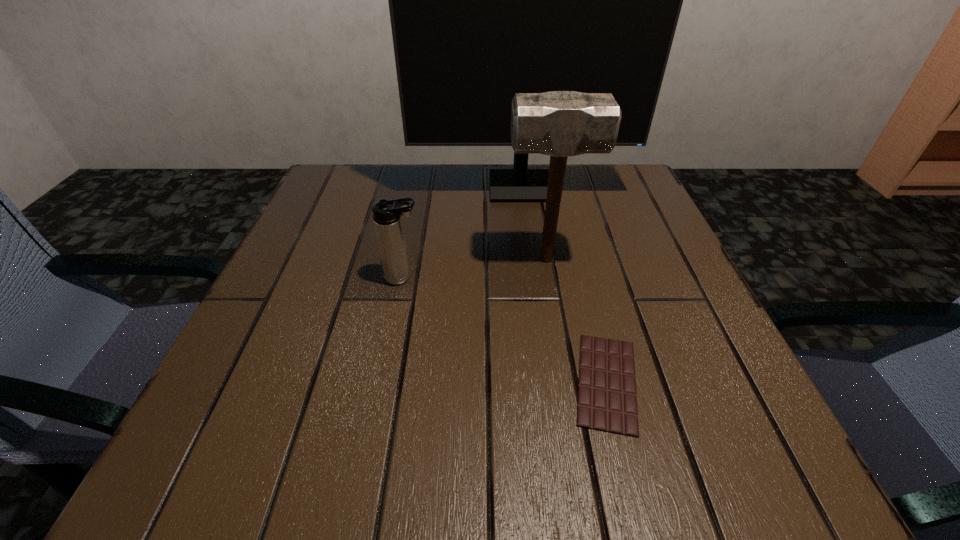
I want to click on vacant position at the left edge of the desktop, so click(297, 251).

In the image, there is a desktop. At what (x,y) coordinates should I click in order to perform the action: click on vacant space at the right edge. Please return your answer as a coordinate pair (x, y). This screenshot has width=960, height=540. Looking at the image, I should click on [660, 348].

The height and width of the screenshot is (540, 960). Identify the location of vacant space at the far left corner. (356, 166).

This screenshot has width=960, height=540. Identify the location of vacant region at the near left corner. 292,482.

Image resolution: width=960 pixels, height=540 pixels. Identify the location of vacant space at the far right corner of the desktop. (624, 204).

Find the location of a particular element. This screenshot has width=960, height=540. free space between the shortest object and the thermos bottle is located at coordinates (505, 329).

Where is `free area in between the mallet and the thermos bottle`? free area in between the mallet and the thermos bottle is located at coordinates (474, 268).

The image size is (960, 540). I want to click on vacant area between the computer monitor and the chocolate bar, so click(564, 285).

Where is `vacant area that lies between the mallet and the computer monitor`? vacant area that lies between the mallet and the computer monitor is located at coordinates (533, 224).

The image size is (960, 540). Identify the location of vacant space in between the shortest object and the third tallest object. (505, 329).